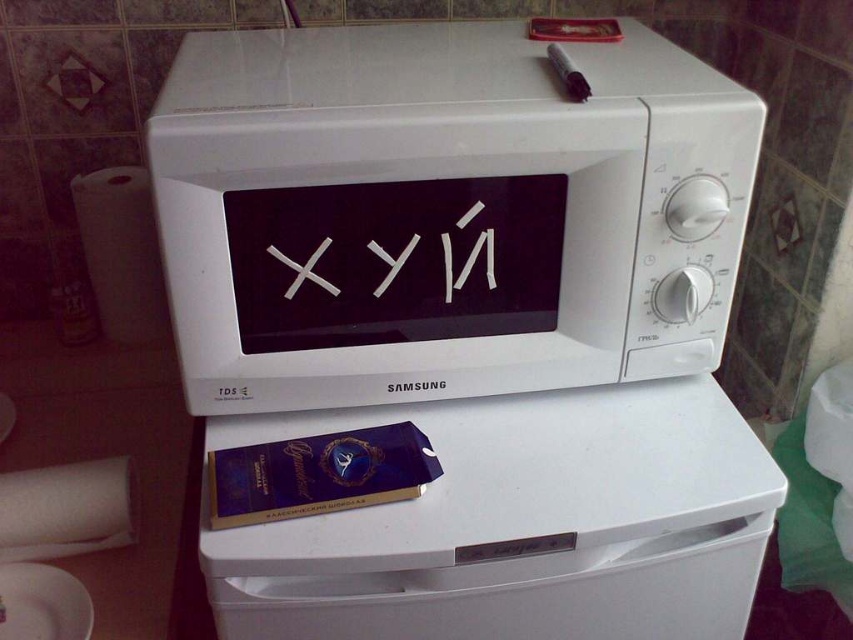
In the scene shown: Is white matte microwave at center further to camera compared to white plastic microwave at upper center?

That is False.

Who is more forward, (351, 339) or (497, 522)?

Point (497, 522)

Identify the location of white matte microwave at center. The image size is (853, 640). (444, 212).